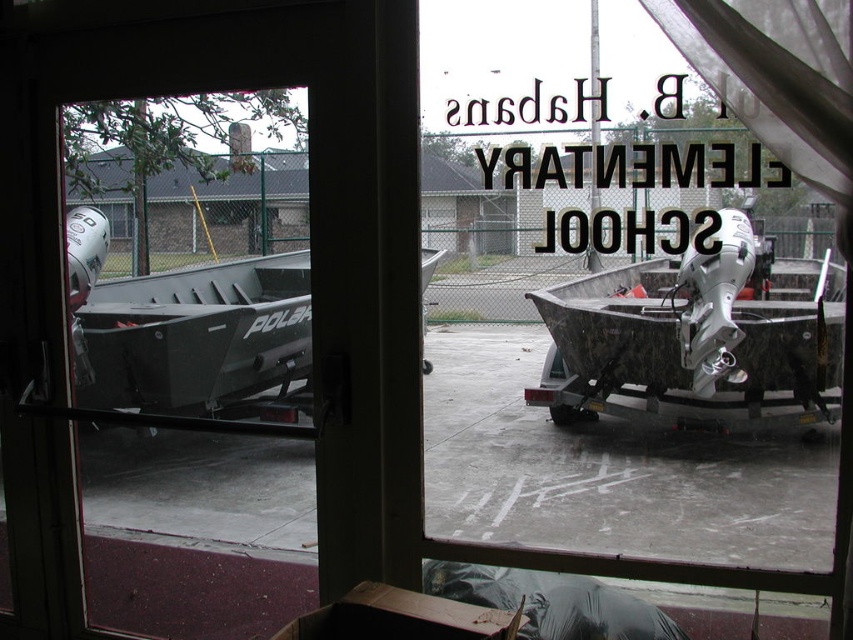
You are standing at the camera position looking through the glass door into the storage area. There is a point marked at coordinates point (428, 198). Can you reach that point without moving through the glass door?

The point (428, 198) is 6.98 feet away from the camera, so yes, you can reach it without moving through the glass door since it is within the storage area visible through the door.

Looking at this image, you are a delivery person trying to enter the storage area through the transparent glass door at center. The matte gray boat at left is blocking your path. Can you walk around the boat to reach the door?

The transparent glass door at center occupies less space than the matte gray boat at left, so you can walk around the matte gray boat at left to reach the transparent glass door at center.